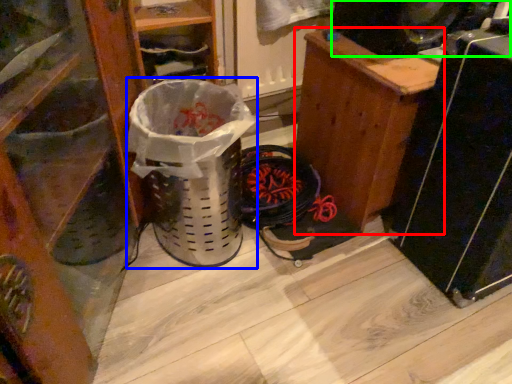
Question: Which is nearer to the furniture (highlighted by a red box)? garbage (highlighted by a blue box) or speaker (highlighted by a green box).

Choices:
 (A) garbage
 (B) speaker

Answer: (B)